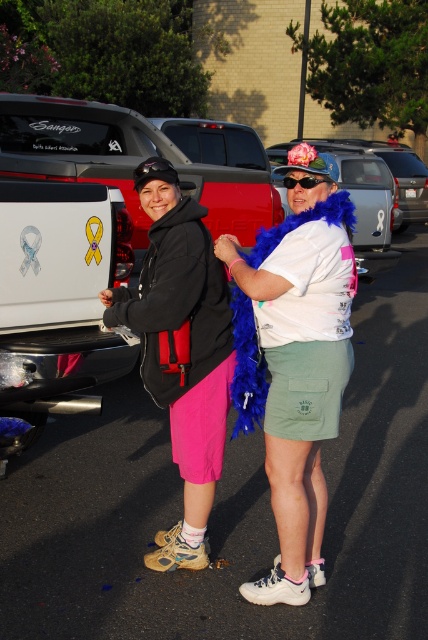
Question: Estimate the real-world distances between objects in this image. Which object is farther from the sunglasses at center?

Choices:
 (A) pink fabric shorts at center
 (B) metallic silver car at center
 (C) white glossy pickup truck at left

Answer: (B)

Question: Which object is positioned farthest from the pink fabric shorts at center?

Choices:
 (A) white glossy pickup truck at left
 (B) sunglasses at center

Answer: (A)

Question: Among these objects, which one is nearest to the camera?

Choices:
 (A) pink fabric shorts at center
 (B) white glossy pickup truck at left
 (C) sunglasses at center

Answer: (A)

Question: Considering the relative positions of pink fabric shorts at center and sunglasses at center in the image provided, where is pink fabric shorts at center located with respect to sunglasses at center?

Choices:
 (A) above
 (B) below

Answer: (B)

Question: Can you confirm if matte black hoodie at center is positioned below sunglasses at center?

Choices:
 (A) no
 (B) yes

Answer: (B)

Question: Does matte black hoodie at center appear on the right side of metallic silver car at center?

Choices:
 (A) no
 (B) yes

Answer: (A)